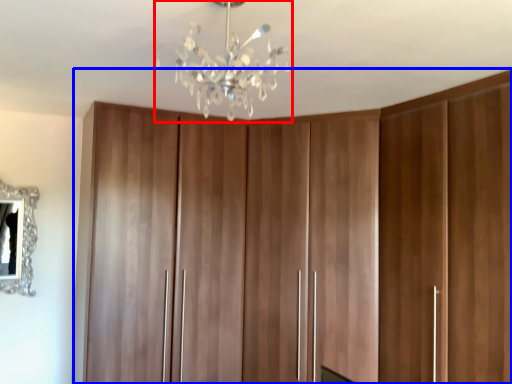
Question: Which object is further to the camera taking this photo, lamp (highlighted by a red box) or cupboard (highlighted by a blue box)?

Choices:
 (A) lamp
 (B) cupboard

Answer: (B)